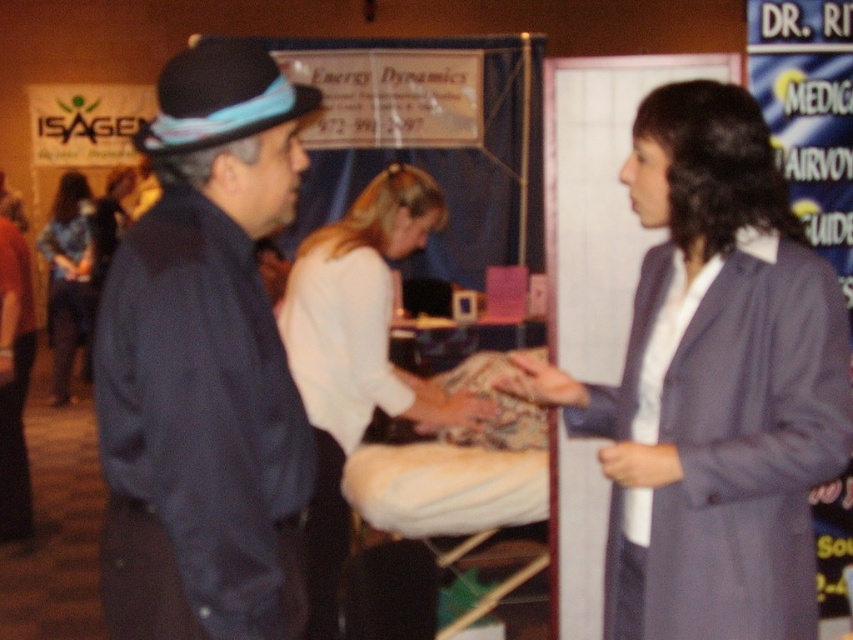
Question: Can you confirm if matte gray blazer at right is positioned to the right of white matte shirt at center?

Choices:
 (A) yes
 (B) no

Answer: (A)

Question: Estimate the real-world distances between objects in this image. Which object is closer to the black felt fedora at left?

Choices:
 (A) white matte shirt at center
 (B) denim pants at left
 (C) dark blue fabric jacket at left
 (D) matte gray blazer at right

Answer: (C)

Question: Which point appears closest to the camera in this image?

Choices:
 (A) (148, 385)
 (B) (77, 289)

Answer: (A)

Question: Does dark blue fabric jacket at left appear on the right side of denim pants at left?

Choices:
 (A) yes
 (B) no

Answer: (A)

Question: Which point is closer to the camera?

Choices:
 (A) (749, 284)
 (B) (309, 344)
 (C) (219, 93)
 (D) (231, 115)

Answer: (C)

Question: Is matte gray blazer at right positioned before denim pants at left?

Choices:
 (A) yes
 (B) no

Answer: (A)